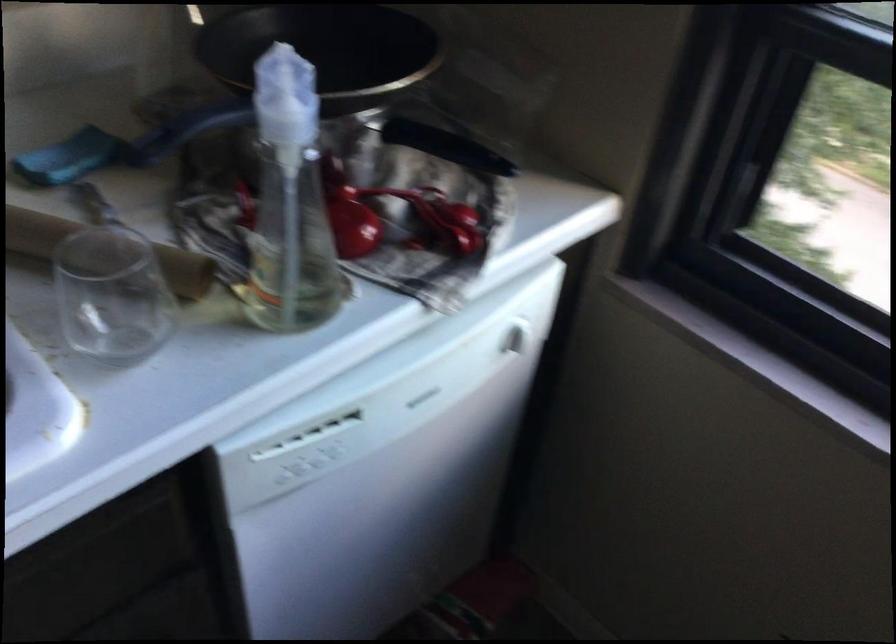
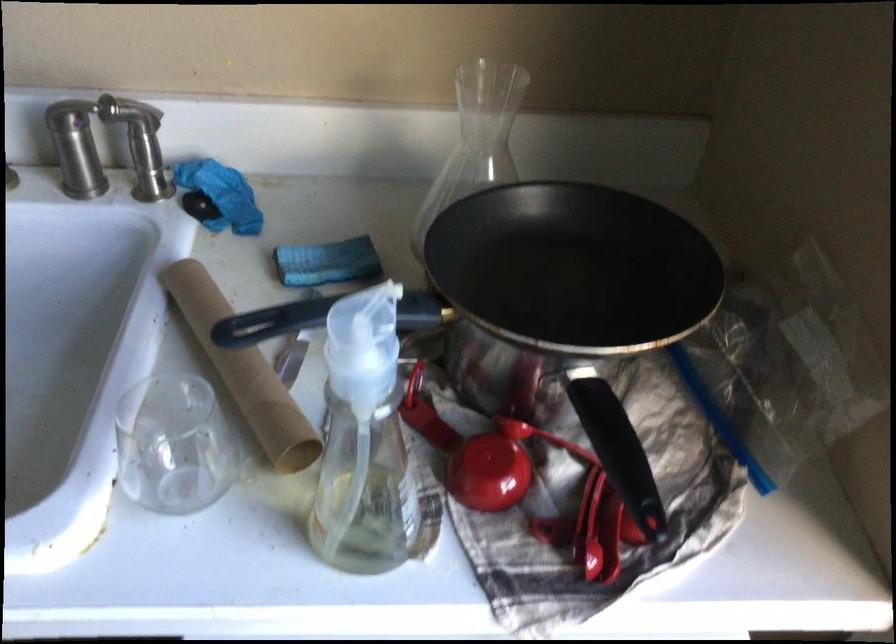
Find the pixel in the second image that matches point 97,249 in the first image.

(243, 371)